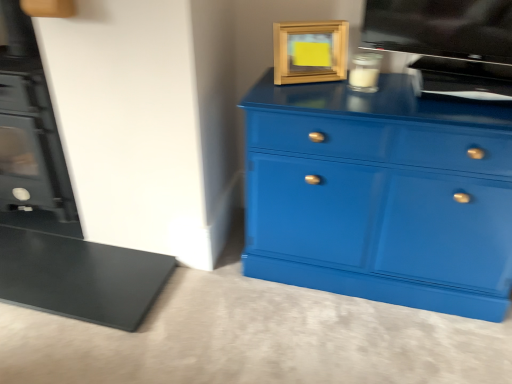
Question: Is clear glass candle at upper center, which appears as the second appliance when viewed from the right, turned away from wooden picture frame at upper center?

Choices:
 (A) yes
 (B) no

Answer: (B)

Question: Does clear glass candle at upper center, placed as the first appliance when sorted from left to right, appear on the right side of wooden picture frame at upper center?

Choices:
 (A) no
 (B) yes

Answer: (B)

Question: Considering the relative positions of clear glass candle at upper center, which appears as the second appliance when viewed from the right, and wooden picture frame at upper center in the image provided, is clear glass candle at upper center, which appears as the second appliance when viewed from the right, to the left of wooden picture frame at upper center from the viewer's perspective?

Choices:
 (A) no
 (B) yes

Answer: (A)

Question: Is clear glass candle at upper center, placed as the first appliance when sorted from left to right, completely or partially outside of wooden picture frame at upper center?

Choices:
 (A) yes
 (B) no

Answer: (A)

Question: From the image's perspective, is clear glass candle at upper center, which appears as the second appliance when viewed from the right, under wooden picture frame at upper center?

Choices:
 (A) yes
 (B) no

Answer: (A)

Question: In terms of width, does wooden picture frame at upper center look wider or thinner when compared to flat screen tv at upper right, the 1th appliance when ordered from right to left?

Choices:
 (A) wide
 (B) thin

Answer: (B)

Question: Does point (287, 44) appear closer or farther from the camera than point (460, 87)?

Choices:
 (A) closer
 (B) farther

Answer: (B)

Question: From a real-world perspective, is wooden picture frame at upper center physically located above or below flat screen tv at upper right, placed as the 2th appliance when sorted from left to right?

Choices:
 (A) below
 (B) above

Answer: (A)

Question: In terms of size, does wooden picture frame at upper center appear bigger or smaller than flat screen tv at upper right, placed as the 2th appliance when sorted from left to right?

Choices:
 (A) big
 (B) small

Answer: (B)

Question: Is flat screen tv at upper right, placed as the 2th appliance when sorted from left to right, inside or outside of wooden picture frame at upper center?

Choices:
 (A) outside
 (B) inside

Answer: (A)

Question: From the image's perspective, is flat screen tv at upper right, placed as the 2th appliance when sorted from left to right, located above or below wooden picture frame at upper center?

Choices:
 (A) above
 (B) below

Answer: (A)

Question: In the image, is flat screen tv at upper right, the 1th appliance when ordered from right to left, on the left side or the right side of wooden picture frame at upper center?

Choices:
 (A) left
 (B) right

Answer: (B)

Question: From a real-world perspective, is flat screen tv at upper right, placed as the 2th appliance when sorted from left to right, positioned above or below wooden picture frame at upper center?

Choices:
 (A) above
 (B) below

Answer: (A)

Question: Would you say glossy blue chest of drawers at center is to the left or to the right of wooden picture frame at upper center in the picture?

Choices:
 (A) left
 (B) right

Answer: (B)

Question: From the image's perspective, relative to wooden picture frame at upper center, is glossy blue chest of drawers at center above or below?

Choices:
 (A) above
 (B) below

Answer: (B)